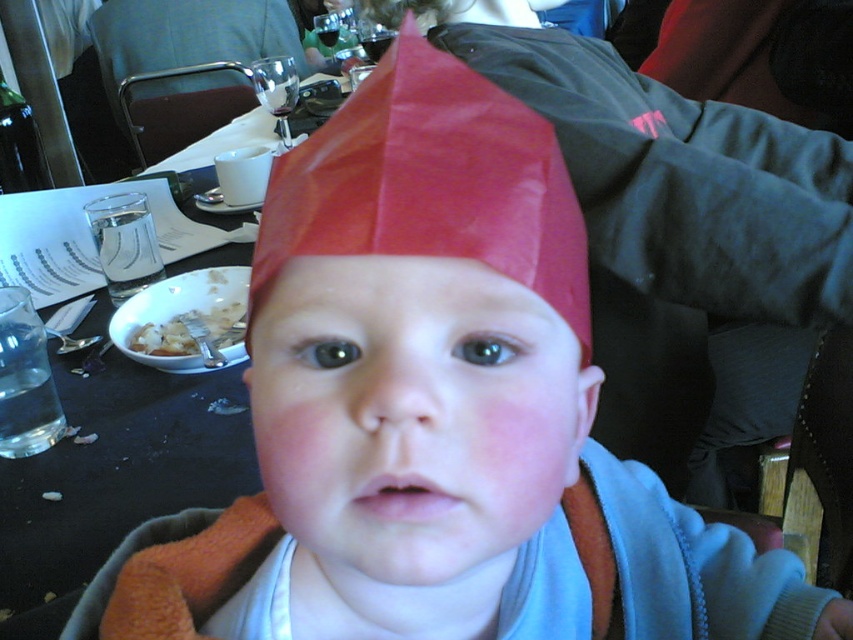
You are a child who wants to reach the white crumbly food at lower left from where you are sitting under the red paper hat at center. Can you comfortably reach it without moving your chair?

The distance between the red paper hat at center and the white crumbly food at lower left is 25.16 inches. Since this distance is within typical comfortable reaching range for a child, you can likely reach the white crumbly food at lower left without moving your chair.

You are a photographer taking a picture of the child wearing the red paper hat at center and the white crumbly food at lower left. Based on their heights, which object will appear larger in the photo?

The red paper hat at center will appear larger in the photo because it has a greater height compared to the white crumbly food at lower left.

The red paper hat at center is positioned between two objects on the table. Which two objects are they?

The red paper hat at center is between a white plate with remnants of food and a glass of water.